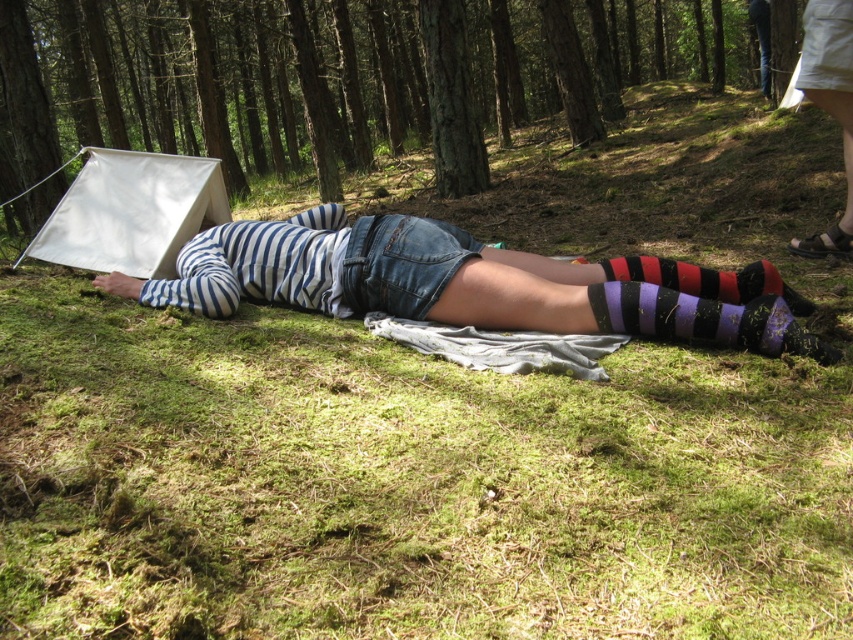
You are a hiker who wants to know the position of the striped fabric at center and the purple striped sock at lower center. Which one is located to the left?

The striped fabric at center is positioned on the left side of purple striped sock at lower center, so the striped fabric at center is to the left of the purple striped sock at lower center.